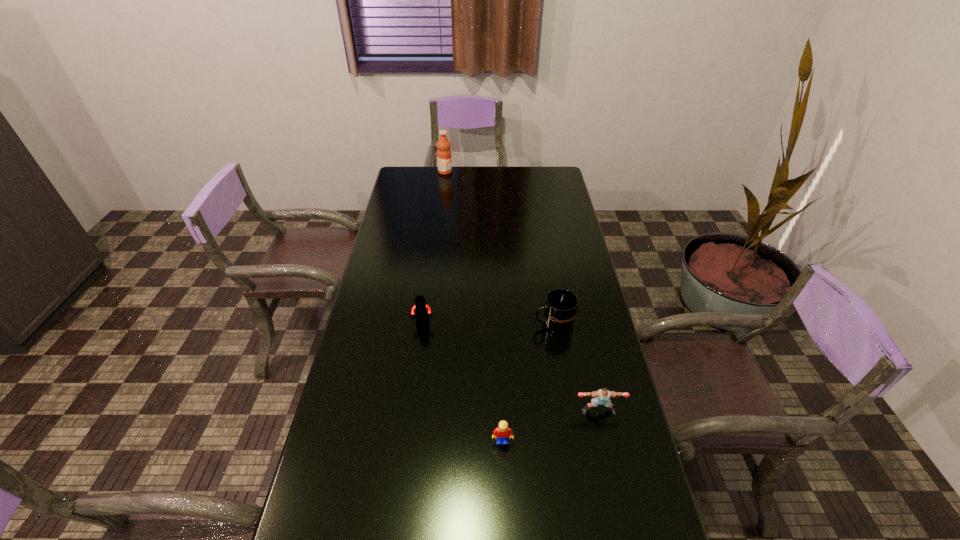
This screenshot has height=540, width=960. Find the location of `vacant region located with the handle on the side of the mug`. vacant region located with the handle on the side of the mug is located at coordinates (438, 323).

This screenshot has width=960, height=540. What are the coordinates of `free space located with the handle on the side of the mug` in the screenshot? It's located at (509, 323).

I want to click on blank area located 0.100m with the handle on the side of the mug, so click(502, 323).

Where is `vacant area situated on the front-facing side of the fourth farthest object`? This screenshot has width=960, height=540. vacant area situated on the front-facing side of the fourth farthest object is located at coordinates (609, 456).

This screenshot has width=960, height=540. What are the coordinates of `vacant space positioned 0.060m on the front-facing side of the nearer Lego` in the screenshot? It's located at (503, 469).

Where is `object that is positioned at the far edge`? The height and width of the screenshot is (540, 960). object that is positioned at the far edge is located at coordinates (444, 160).

In order to click on mug present at the right edge in this screenshot , I will do `click(560, 308)`.

The image size is (960, 540). I want to click on puncher situated at the right edge, so click(x=602, y=396).

Find the location of a particular element. The image size is (960, 540). free space at the far edge is located at coordinates (503, 180).

I want to click on free space at the left edge of the desktop, so click(416, 276).